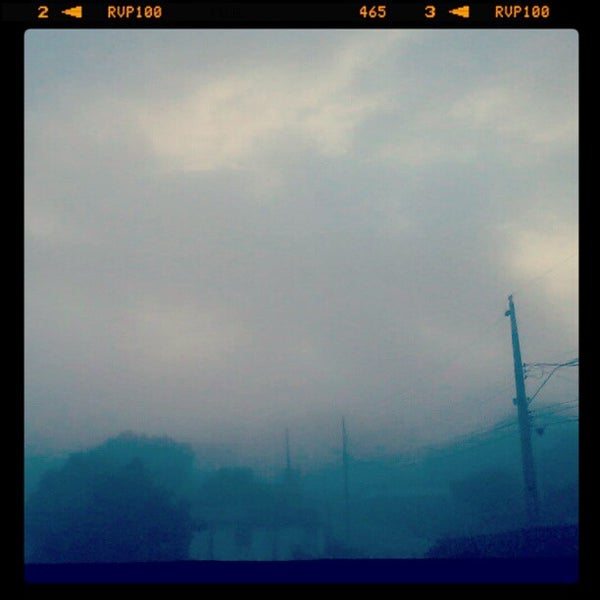
Where is `cable`? The width and height of the screenshot is (600, 600). cable is located at coordinates (538, 387).